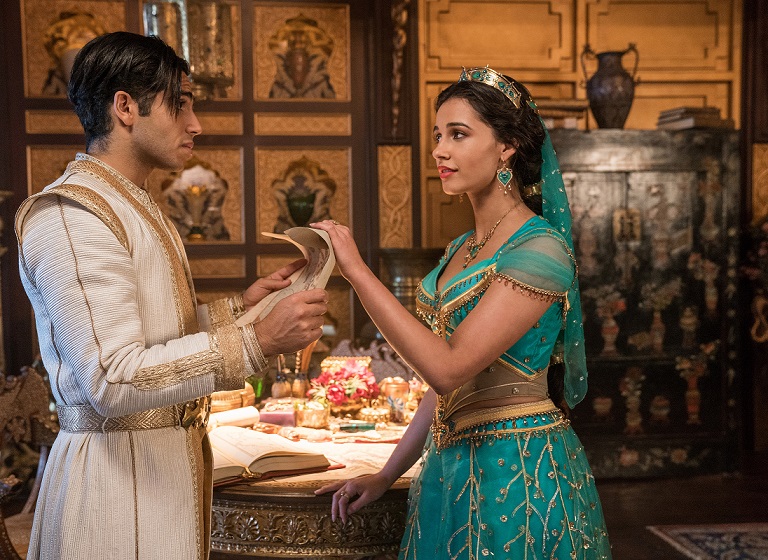
Locate an element on the screen. The width and height of the screenshot is (768, 560). paneling is located at coordinates (511, 39), (653, 27).